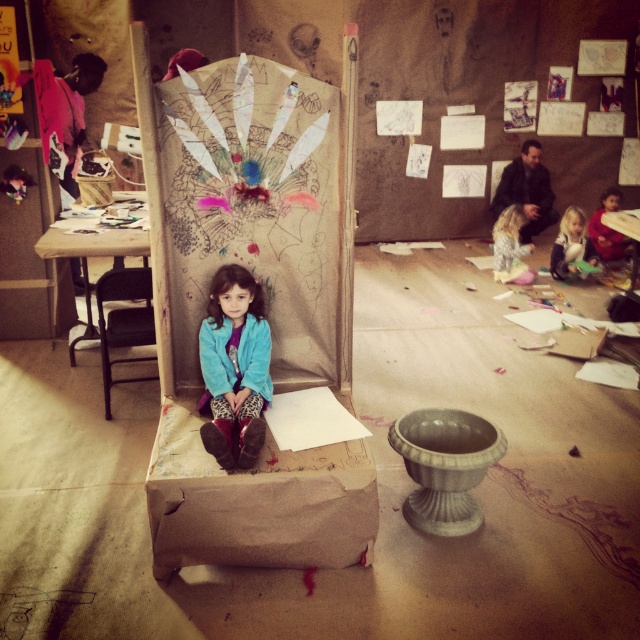
Question: Where is black metal chair at left located in relation to fluffy gray sweater at lower right in the image?

Choices:
 (A) right
 (B) left

Answer: (B)

Question: Which object is closer to the camera taking this photo?

Choices:
 (A) matte blue jacket at center
 (B) red velvet dress at lower right
 (C) fluffy gray sweater at lower right

Answer: (A)

Question: Which of the following is the closest to the observer?

Choices:
 (A) cardboard bulletin board at center
 (B) black metal chair at left

Answer: (A)

Question: Can you confirm if black metal chair at left is positioned below fluffy gray sweater at lower right?

Choices:
 (A) no
 (B) yes

Answer: (B)

Question: Which is nearer to the matte blue jacket at center?

Choices:
 (A) black metal chair at left
 (B) cardboard bulletin board at center

Answer: (B)

Question: Observing the image, what is the correct spatial positioning of matte blue sweater at center in reference to red velvet dress at lower right?

Choices:
 (A) above
 (B) below

Answer: (B)